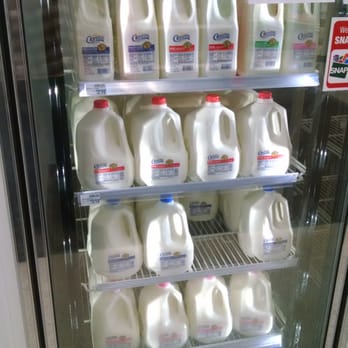
I want to click on milk on front left side of shelf, so click(102, 315), click(107, 252), click(107, 163), click(100, 58).